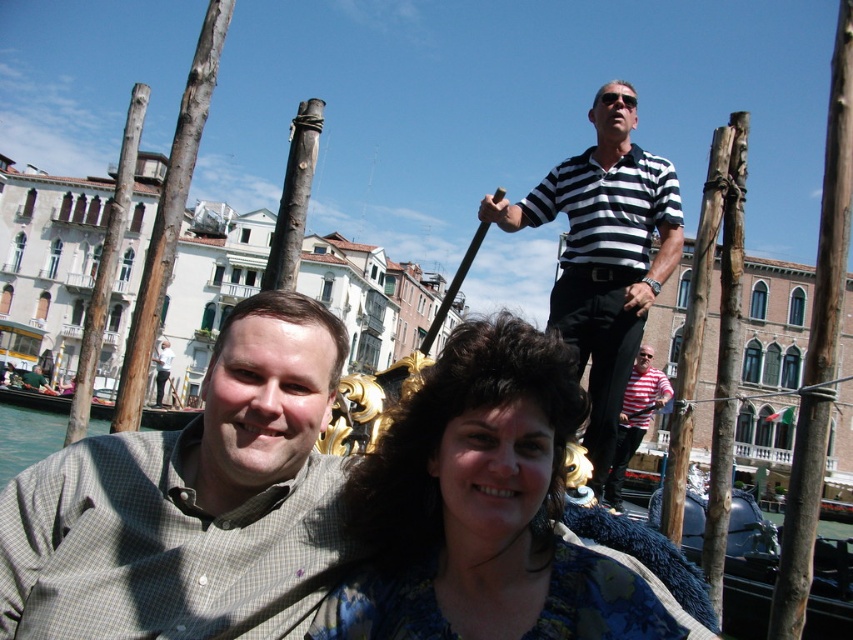
Question: Is black striped shirt at upper center positioned behind striped cotton shirt at upper center?

Choices:
 (A) yes
 (B) no

Answer: (B)

Question: Which object is the closest to the striped cotton shirt at upper center?

Choices:
 (A) black striped shirt at upper center
 (B) blue floral blouse at center

Answer: (A)

Question: Which of the following is the closest to the observer?

Choices:
 (A) blue floral blouse at center
 (B) gray checkered shirt at center

Answer: (B)

Question: Can you confirm if blue floral blouse at center is positioned to the right of black striped shirt at upper center?

Choices:
 (A) yes
 (B) no

Answer: (B)

Question: Which object is the farthest from the blue floral blouse at center?

Choices:
 (A) striped cotton shirt at upper center
 (B) black striped shirt at upper center

Answer: (A)

Question: Does blue floral blouse at center come in front of black striped shirt at upper center?

Choices:
 (A) no
 (B) yes

Answer: (B)